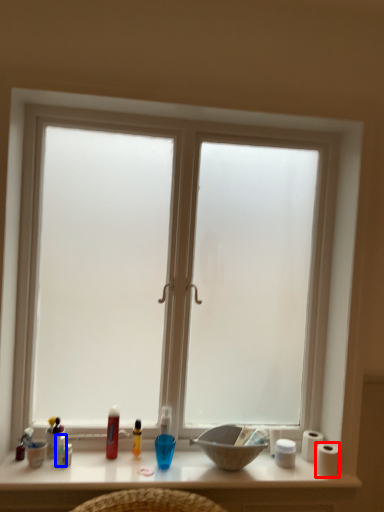
Question: Which of the following is the closest to the observer, toilet paper (highlighted by a red box) or toiletry (highlighted by a blue box)?

Choices:
 (A) toilet paper
 (B) toiletry

Answer: (B)